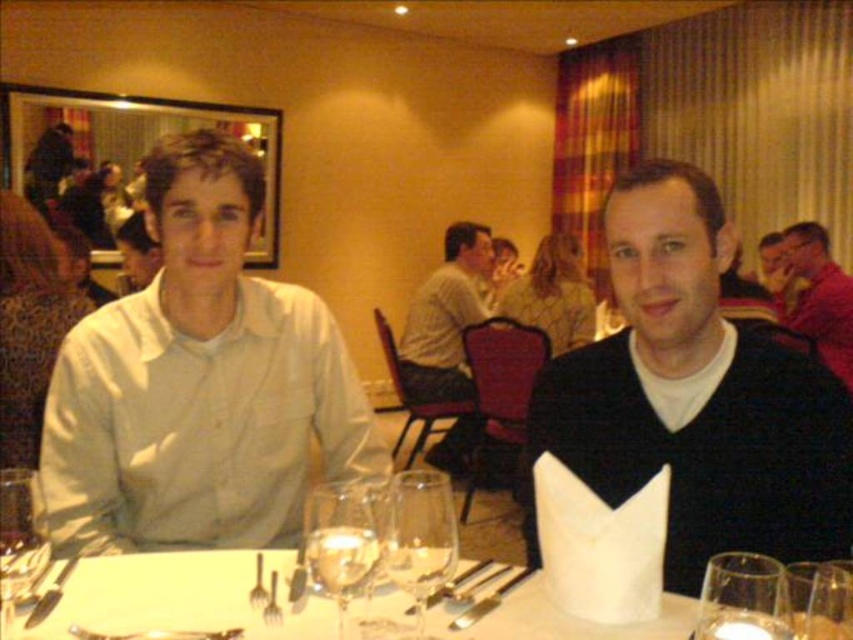
Question: Which object is closer to the camera taking this photo?

Choices:
 (A) white paper napkin at center
 (B) light gray shirt at center

Answer: (A)

Question: Is patterned fabric dress at center positioned at the back of metallic fork at center?

Choices:
 (A) yes
 (B) no

Answer: (A)

Question: Can you confirm if matte black shirt at upper right is positioned to the left of metallic fork at center?

Choices:
 (A) no
 (B) yes

Answer: (A)

Question: Among these points, which one is farthest from the camera?

Choices:
 (A) pyautogui.click(x=408, y=532)
 (B) pyautogui.click(x=281, y=618)

Answer: (B)

Question: Considering the relative positions of matte white shirt at left and metallic fork at center in the image provided, where is matte white shirt at left located with respect to metallic fork at center?

Choices:
 (A) above
 (B) below

Answer: (A)

Question: Which object is closer to the camera taking this photo?

Choices:
 (A) transparent glass wine glass at center
 (B) matte black shirt at upper right
 (C) matte white shirt at left
 (D) black matte sweater at center

Answer: (A)